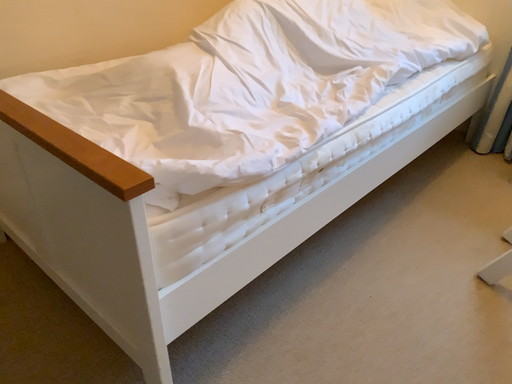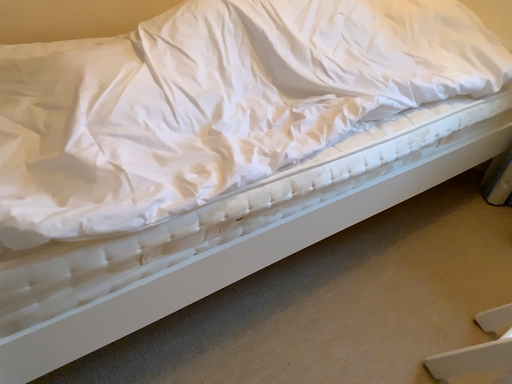
Question: How did the camera likely rotate when shooting the video?

Choices:
 (A) rotated right
 (B) rotated left

Answer: (B)